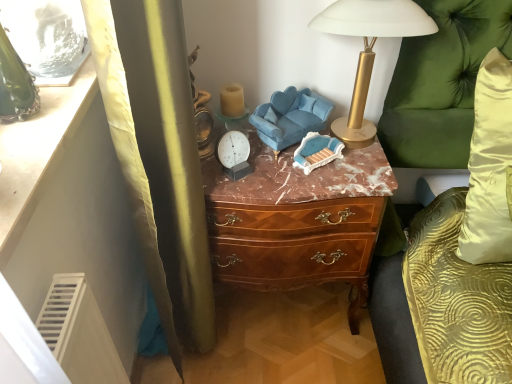
Question: Is velvet blue swivel chair at center located within green velvet couch at right?

Choices:
 (A) no
 (B) yes

Answer: (A)

Question: Does green velvet couch at right have a smaller size compared to velvet blue swivel chair at center?

Choices:
 (A) yes
 (B) no

Answer: (B)

Question: Considering the relative sizes of green velvet couch at right and velvet blue swivel chair at center in the image provided, is green velvet couch at right shorter than velvet blue swivel chair at center?

Choices:
 (A) yes
 (B) no

Answer: (B)

Question: Considering the relative positions of green velvet couch at right and velvet blue swivel chair at center in the image provided, is green velvet couch at right in front of velvet blue swivel chair at center?

Choices:
 (A) no
 (B) yes

Answer: (B)

Question: Is green velvet couch at right to the right of velvet blue swivel chair at center from the viewer's perspective?

Choices:
 (A) no
 (B) yes

Answer: (B)

Question: Can you see green velvet couch at right touching velvet blue swivel chair at center?

Choices:
 (A) yes
 (B) no

Answer: (B)

Question: From a real-world perspective, is brown wood chest of drawers at center positioned under velvet blue swivel chair at center based on gravity?

Choices:
 (A) yes
 (B) no

Answer: (A)

Question: Considering the relative sizes of brown wood chest of drawers at center and velvet blue swivel chair at center in the image provided, is brown wood chest of drawers at center shorter than velvet blue swivel chair at center?

Choices:
 (A) yes
 (B) no

Answer: (B)

Question: Does brown wood chest of drawers at center have a lesser width compared to velvet blue swivel chair at center?

Choices:
 (A) yes
 (B) no

Answer: (B)

Question: Is brown wood chest of drawers at center oriented away from velvet blue swivel chair at center?

Choices:
 (A) yes
 (B) no

Answer: (B)

Question: Considering the relative sizes of brown wood chest of drawers at center and velvet blue swivel chair at center in the image provided, is brown wood chest of drawers at center bigger than velvet blue swivel chair at center?

Choices:
 (A) no
 (B) yes

Answer: (B)

Question: Is brown wood chest of drawers at center smaller than velvet blue swivel chair at center?

Choices:
 (A) no
 (B) yes

Answer: (A)

Question: Considering the relative sizes of velvet blue swivel chair at center and green velvet couch at right in the image provided, is velvet blue swivel chair at center bigger than green velvet couch at right?

Choices:
 (A) no
 (B) yes

Answer: (A)